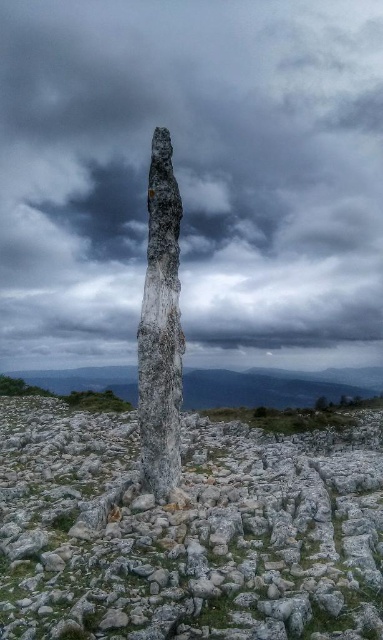
Is gray cloudy sky at upper center thinner than white stone pillar at center?

Incorrect, gray cloudy sky at upper center's width is not less than white stone pillar at center's.

Is point (44, 3) behind point (302, 452)?

Yes.

The width and height of the screenshot is (383, 640). In order to click on gray cloudy sky at upper center in this screenshot , I will do `click(193, 177)`.